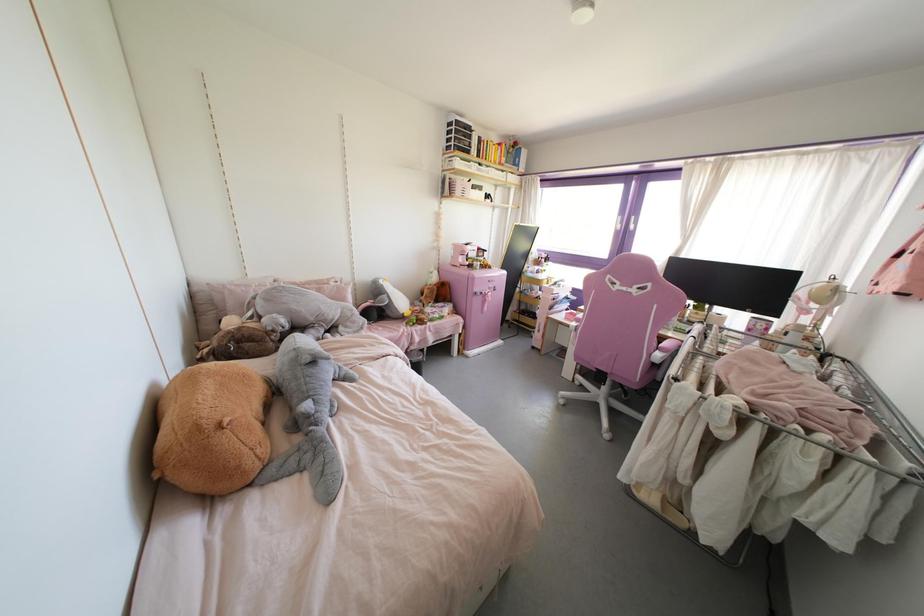
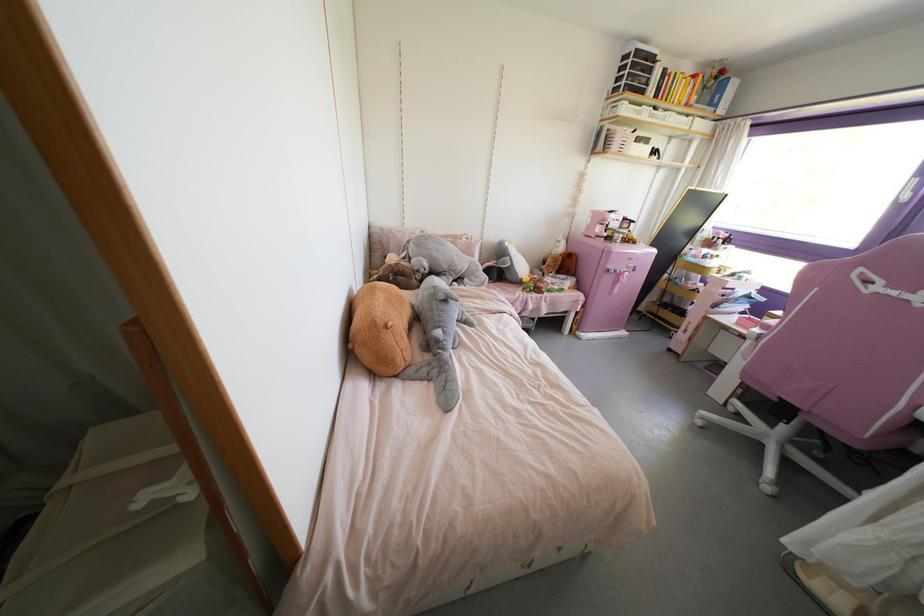
The point at (493,290) is marked in the first image. Where is the corresponding point in the second image?

(633, 270)